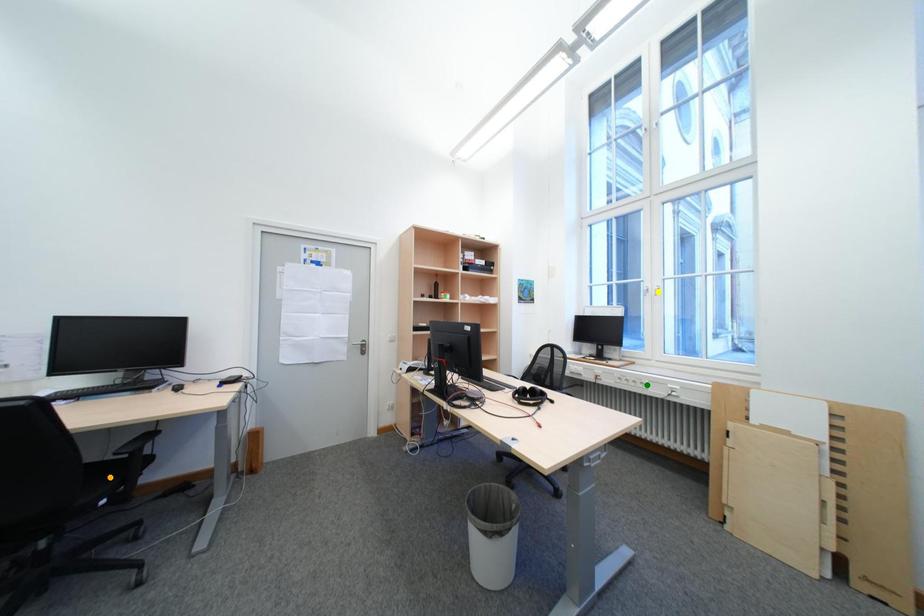
Order these from farthest to nearest:
A) orange point
B) green point
C) yellow point

yellow point → green point → orange point